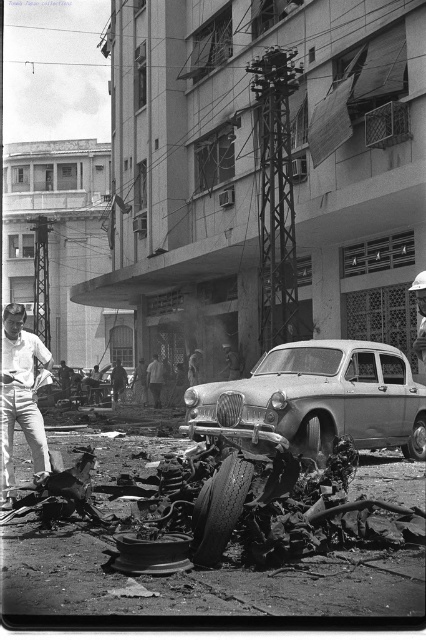
Question: Considering the real-world distances, which object is farthest from the rubber/smooth tire at center?

Choices:
 (A) white cotton shirt at left
 (B) rubber/textured tire at lower center
 (C) rusty metal car at center

Answer: (B)

Question: Can you confirm if rusty metal car at center is thinner than white cotton shirt at left?

Choices:
 (A) no
 (B) yes

Answer: (A)

Question: Does rubber/textured tire at lower center appear over rubber/smooth tire at center?

Choices:
 (A) no
 (B) yes

Answer: (B)

Question: Based on their relative distances, which object is farther from the rusty metal car at center?

Choices:
 (A) rubber/smooth tire at center
 (B) rubber/textured tire at lower center
 (C) white cotton shirt at left

Answer: (B)

Question: Is rusty metal car at center to the left of white cotton shirt at left from the viewer's perspective?

Choices:
 (A) yes
 (B) no

Answer: (B)

Question: Which point is farther to the camera?

Choices:
 (A) (408, 442)
 (B) (8, 396)
 (C) (224, 516)
 (D) (322, 390)

Answer: (A)